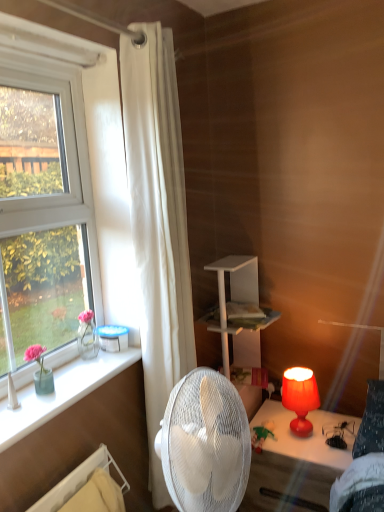
The width and height of the screenshot is (384, 512). I want to click on vacant area that lies in front of matte orange lampshade at lower right, so click(x=312, y=456).